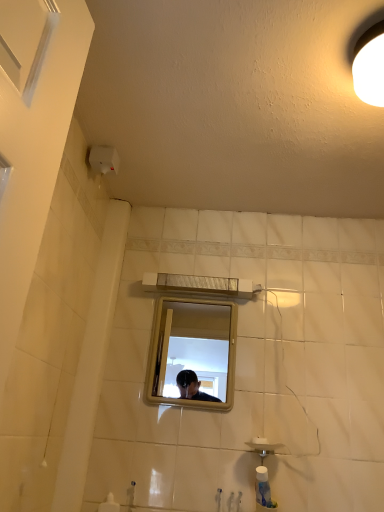
What is the approximate height of matte silver faucet at lower center?

matte silver faucet at lower center is 9.65 inches in height.

The height and width of the screenshot is (512, 384). I want to click on matte silver faucet at lower center, so click(131, 496).

What is the approximate height of metallic rectangular mirror at center?

It is 16.77 inches.

This screenshot has height=512, width=384. I want to click on matte silver faucet at lower center, so click(x=131, y=496).

Considering the sizes of matte silver faucet at lower center and metallic rectangular mirror at center in the image, is matte silver faucet at lower center bigger or smaller than metallic rectangular mirror at center?

Considering their sizes, matte silver faucet at lower center takes up less space than metallic rectangular mirror at center.

In the scene shown: From the image's perspective, is matte silver faucet at lower center above metallic rectangular mirror at center?

No, from the image's perspective, matte silver faucet at lower center is not on top of metallic rectangular mirror at center.

Which object is closer to the camera, matte silver faucet at lower center or metallic rectangular mirror at center?

matte silver faucet at lower center is closer to the camera.

Is metallic rectangular mirror at center oriented away from white matte light fixture at upper right?

No.

Visually, is metallic rectangular mirror at center positioned to the left or to the right of white matte light fixture at upper right?

From the image, it's evident that metallic rectangular mirror at center is to the left of white matte light fixture at upper right.

Does metallic rectangular mirror at center have a larger size compared to white matte light fixture at upper right?

No, metallic rectangular mirror at center is not bigger than white matte light fixture at upper right.

Measure the distance from metallic rectangular mirror at center to white matte light fixture at upper right.

metallic rectangular mirror at center and white matte light fixture at upper right are 2.59 meters apart.

The width and height of the screenshot is (384, 512). Identify the location of faucet below the white matte light fixture at upper right (from a real-world perspective). click(x=131, y=496).

From the image's perspective, does white matte light fixture at upper right appear higher than matte silver faucet at lower center?

Indeed, from the image's perspective, white matte light fixture at upper right is shown above matte silver faucet at lower center.

How much distance is there between white matte light fixture at upper right and matte silver faucet at lower center?

4.75 feet.

Which object is closer to the camera, white matte light fixture at upper right or matte silver faucet at lower center?

Positioned in front is white matte light fixture at upper right.

In the scene shown: Which is more to the left, white matte light fixture at upper right or metallic rectangular mirror at center?

metallic rectangular mirror at center is more to the left.

Does white matte light fixture at upper right have a larger size compared to metallic rectangular mirror at center?

Indeed, white matte light fixture at upper right has a larger size compared to metallic rectangular mirror at center.

Which point is more forward, [375,54] or [209,362]?

Point [375,54]

From a real-world perspective, relative to metallic rectangular mirror at center, is white matte light fixture at upper right vertically above or below?

white matte light fixture at upper right is above metallic rectangular mirror at center.

Considering their positions, is matte silver faucet at lower center located in front of or behind white matte light fixture at upper right?

In the image, matte silver faucet at lower center appears behind white matte light fixture at upper right.

In the scene shown: Is white matte light fixture at upper right a part of matte silver faucet at lower center?

No, white matte light fixture at upper right is not a part of matte silver faucet at lower center.

Is matte silver faucet at lower center facing away from white matte light fixture at upper right?

No, matte silver faucet at lower center is not facing away from white matte light fixture at upper right.

Considering the sizes of objects metallic rectangular mirror at center and matte silver faucet at lower center in the image provided, who is bigger, metallic rectangular mirror at center or matte silver faucet at lower center?

Bigger between the two is metallic rectangular mirror at center.

Is metallic rectangular mirror at center placed right next to matte silver faucet at lower center?

metallic rectangular mirror at center and matte silver faucet at lower center are clearly separated.

What's the angular difference between metallic rectangular mirror at center and matte silver faucet at lower center's facing directions?

They differ by 0.0736 degrees in their facing directions.

Between metallic rectangular mirror at center and matte silver faucet at lower center, which one appears on the right side from the viewer's perspective?

metallic rectangular mirror at center.

Identify the location of faucet below the metallic rectangular mirror at center (from the image's perspective). The width and height of the screenshot is (384, 512). (131, 496).

In order to click on light fixture above the metallic rectangular mirror at center (from a real-world perspective) in this screenshot , I will do `click(370, 66)`.

Considering their positions, is white matte light fixture at upper right positioned further to metallic rectangular mirror at center than matte silver faucet at lower center?

white matte light fixture at upper right lies further to metallic rectangular mirror at center than the other object.

Estimate the real-world distances between objects in this image. Which object is further from white matte light fixture at upper right, matte silver faucet at lower center or metallic rectangular mirror at center?

Based on the image, metallic rectangular mirror at center appears to be further to white matte light fixture at upper right.

Which object lies further to the anchor point metallic rectangular mirror at center, matte silver faucet at lower center or white matte light fixture at upper right?

white matte light fixture at upper right is further to metallic rectangular mirror at center.

From the image, which object appears to be nearer to white matte light fixture at upper right, metallic rectangular mirror at center or matte silver faucet at lower center?

matte silver faucet at lower center lies closer to white matte light fixture at upper right than the other object.

Based on their spatial positions, is metallic rectangular mirror at center or white matte light fixture at upper right further from matte silver faucet at lower center?

metallic rectangular mirror at center.

Considering their positions, is white matte light fixture at upper right positioned closer to matte silver faucet at lower center than metallic rectangular mirror at center?

white matte light fixture at upper right lies closer to matte silver faucet at lower center than the other object.

This screenshot has width=384, height=512. In order to click on mirror between white matte light fixture at upper right and matte silver faucet at lower center in the vertical direction in this screenshot , I will do `click(193, 353)`.